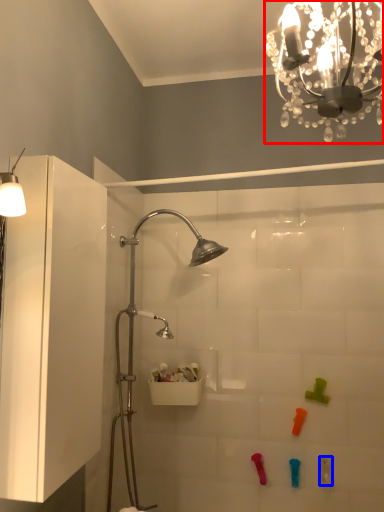
Question: Which object appears farthest to the camera in this image, light fixture (highlighted by a red box) or toy (highlighted by a blue box)?

Choices:
 (A) light fixture
 (B) toy

Answer: (B)